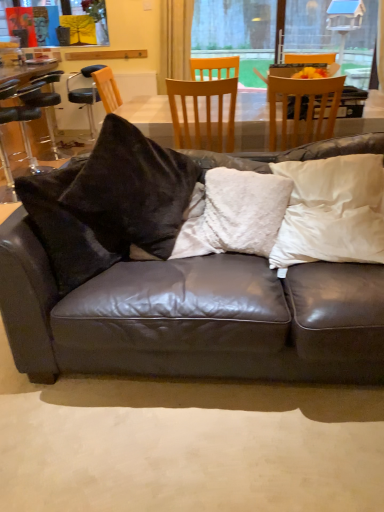
Question: Is yellow fabric at upper left wider or thinner than light brown wooden chair at upper center, the 3th chair from the left?

Choices:
 (A) thin
 (B) wide

Answer: (A)

Question: In terms of height, does yellow fabric at upper left look taller or shorter compared to light brown wooden chair at upper center, which is the 3th chair from back to front?

Choices:
 (A) short
 (B) tall

Answer: (A)

Question: Which of these objects is positioned farthest from the light brown wooden chair at upper center, which appears as the 1th chair when viewed from the front?

Choices:
 (A) light brown wooden chair at center, the 2th chair in the front-to-back sequence
 (B) yellow fabric at upper left
 (C) black leather bar stool at left, the first chair positioned from the back
 (D) black leather bar stool at left
 (E) fluffy white pillow at center, the 2th pillow when ordered from right to left

Answer: (B)

Question: Which of these objects is positioned farthest from the black leather bar stool at left, placed as the third chair when sorted from right to left?

Choices:
 (A) white soft pillow at right, the second pillow viewed from the left
 (B) black leather bar stool at left
 (C) light brown wooden chair at center, marked as the second chair in a right-to-left arrangement
 (D) light brown wooden chair at upper center, which is the 3th chair from back to front
 (E) fluffy white pillow at center, the 2th pillow when ordered from right to left

Answer: (A)